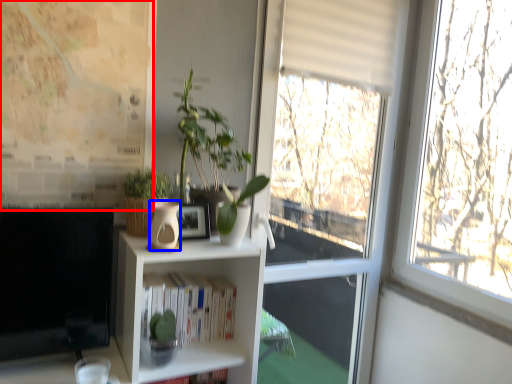
Question: Which of the following is the closest to the observer, bulletin board (highlighted by a red box) or vase (highlighted by a blue box)?

Choices:
 (A) bulletin board
 (B) vase

Answer: (B)